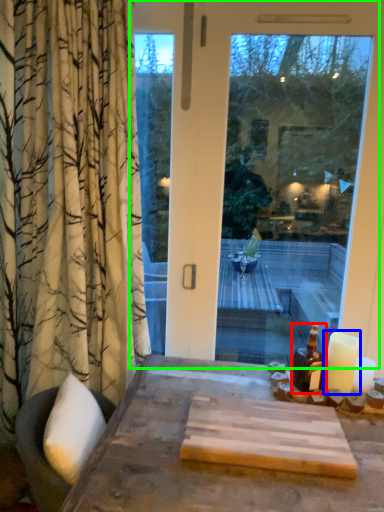
Question: Which object is the closest to the bottle (highlighted by a red box)? Choose among these: candle (highlighted by a blue box) or window (highlighted by a green box).

Choices:
 (A) candle
 (B) window

Answer: (A)